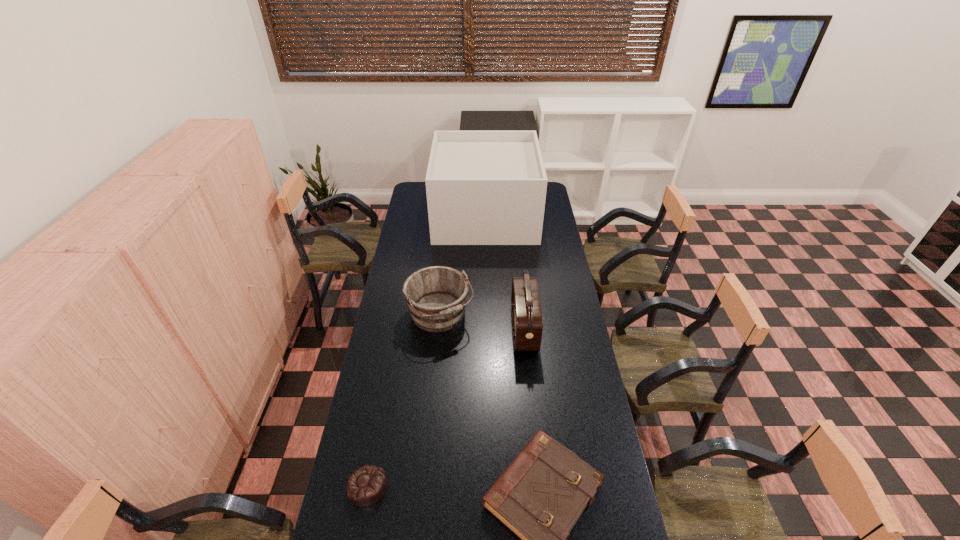
Where is `the third closest object relative to the fourth shortest object`? The height and width of the screenshot is (540, 960). the third closest object relative to the fourth shortest object is located at coordinates (483, 187).

Locate an element on the screen. This screenshot has height=540, width=960. the third closest object relative to the fourth tallest object is located at coordinates (436, 296).

Find the location of `free location that satisfies the following two spatial constraints: 1. on the side of the box with the window; 2. on the front side of the third shortest object`. free location that satisfies the following two spatial constraints: 1. on the side of the box with the window; 2. on the front side of the third shortest object is located at coordinates (487, 315).